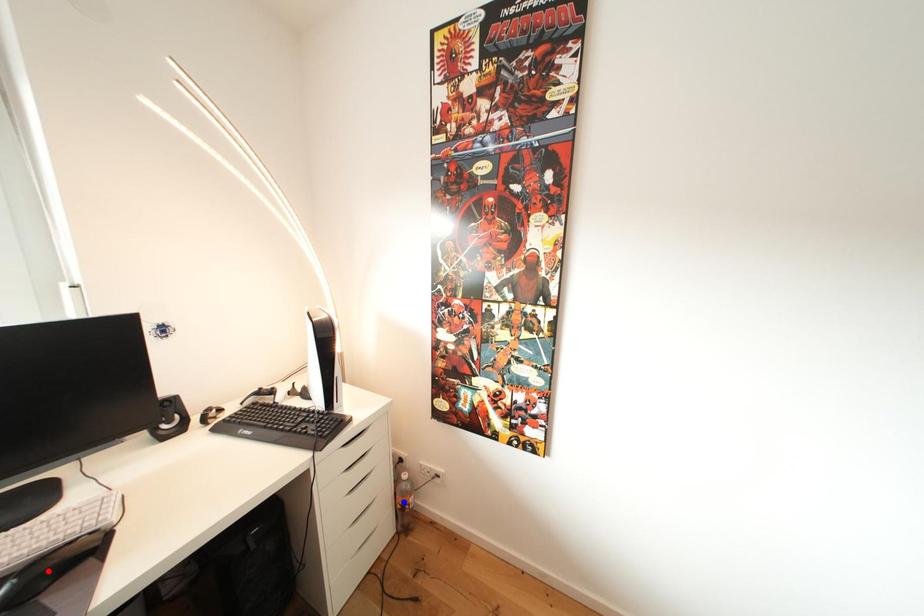
Question: Two points are marked on the image. Which point is closer to the camera?

Choices:
 (A) Blue point is closer.
 (B) Red point is closer.

Answer: (B)